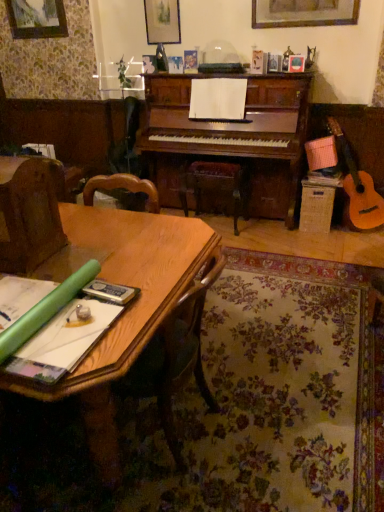
You are a GUI agent. You are given a task and a screenshot of the screen. Output one action in this format:
    pyautogui.click(x=<x>, y=<y>)
    Task: Click on the free point to the right of brown fabric armchair at left
    This screenshot has width=384, height=512.
    Given the screenshot: What is the action you would take?
    pyautogui.click(x=93, y=251)